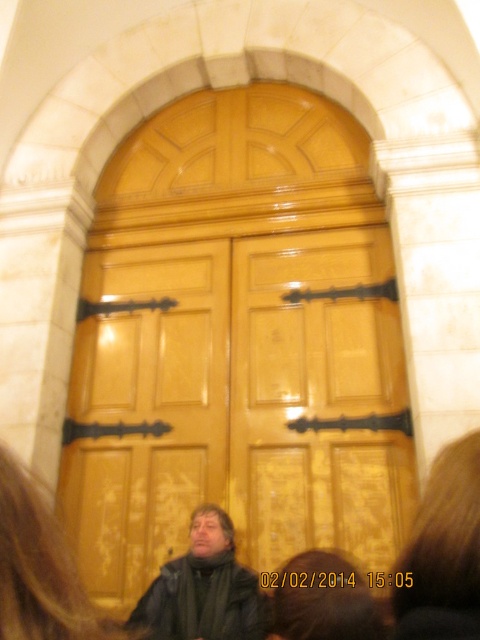
Which of these two, glossy wood door at center or dark brown leather jacket at center, stands shorter?

Standing shorter between the two is dark brown leather jacket at center.

Which is above, glossy wood door at center or dark brown leather jacket at center?

Positioned higher is glossy wood door at center.

Who is more forward, (288,449) or (202,529)?

Point (202,529) is more forward.

Identify the location of glossy wood door at center. Image resolution: width=480 pixels, height=640 pixels. (238, 394).